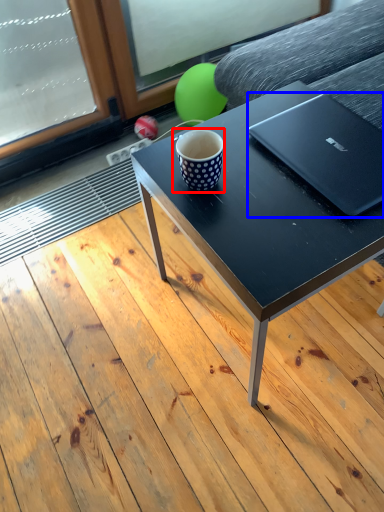
Question: Among these objects, which one is nearest to the camera, coffee cup (highlighted by a red box) or laptop (highlighted by a blue box)?

Choices:
 (A) coffee cup
 (B) laptop

Answer: (B)